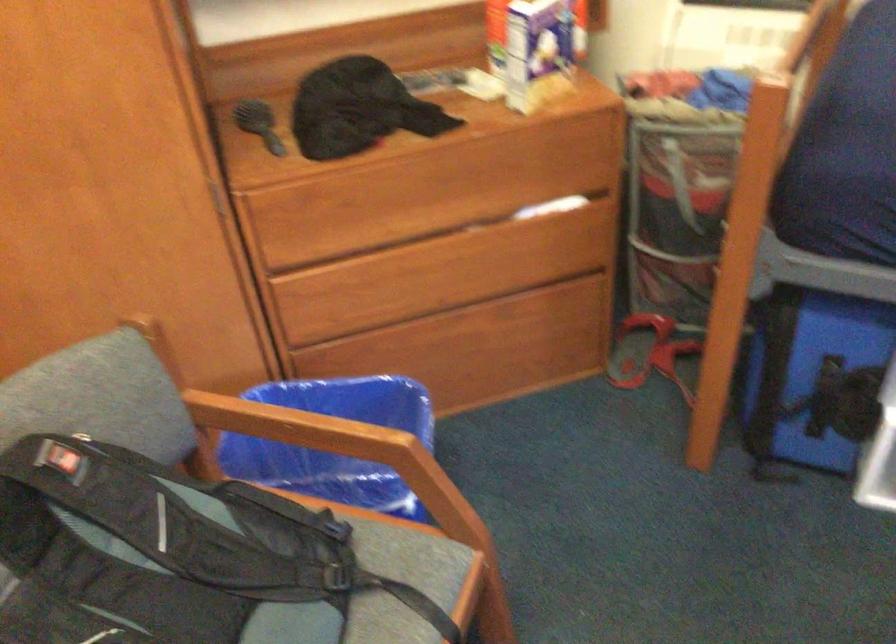
Where is `chair sitting surface`? This screenshot has width=896, height=644. chair sitting surface is located at coordinates (352, 514).